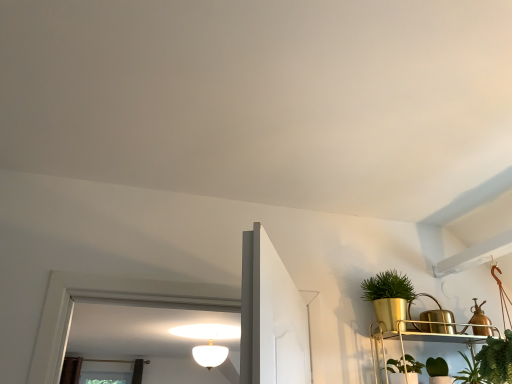
Locate an element on the screen. Image resolution: width=512 pixels, height=384 pixels. white frosted glass lamp at center is located at coordinates (210, 355).

This screenshot has height=384, width=512. What do you see at coordinates (210, 355) in the screenshot?
I see `white frosted glass lamp at center` at bounding box center [210, 355].

The image size is (512, 384). Identify the location of white frosted glass lamp at center. (210, 355).